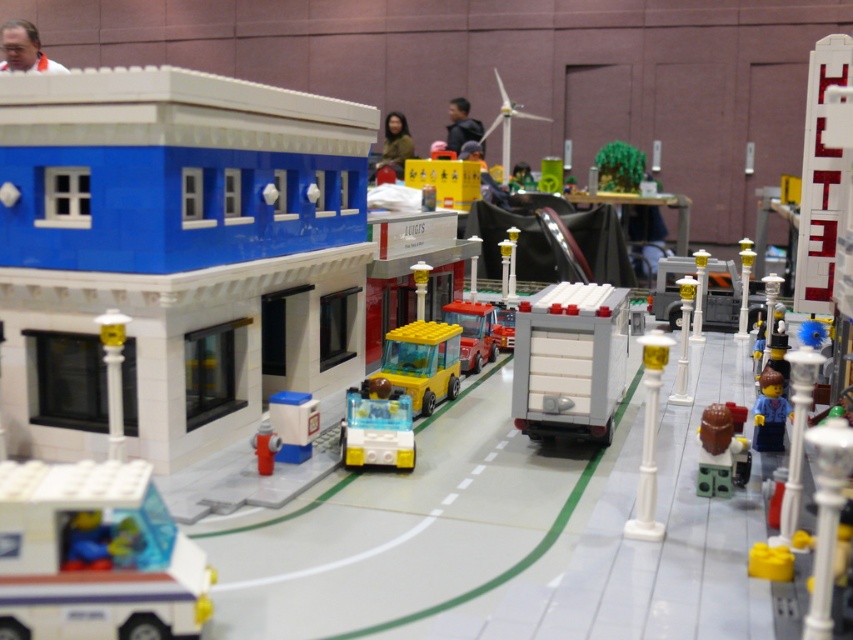
Is the position of translucent blue plastic car at center more distant than that of translucent blue plastic at center?

Yes, translucent blue plastic car at center is further from the viewer.

Is point (370, 387) less distant than point (277, 454)?

No, it is not.

Describe the element at coordinates (376, 426) in the screenshot. The width and height of the screenshot is (853, 640). I see `translucent blue plastic car at center` at that location.

Identify the location of translucent blue plastic car at center. (376, 426).

Does translucent blue plastic car at center appear on the right side of matte orange shirt at upper left?

Yes, translucent blue plastic car at center is to the right of matte orange shirt at upper left.

Identify the location of translucent blue plastic car at center. The height and width of the screenshot is (640, 853). (376, 426).

Does translucent blue plastic car at center appear over matte brown hair at center?

No, translucent blue plastic car at center is not above matte brown hair at center.

Which is in front, point (346, 417) or point (389, 136)?

Positioned in front is point (346, 417).

At what (x,y) coordinates should I click in order to perform the action: click on translucent blue plastic car at center. Please return your answer as a coordinate pair (x, y). The width and height of the screenshot is (853, 640). Looking at the image, I should click on (376, 426).